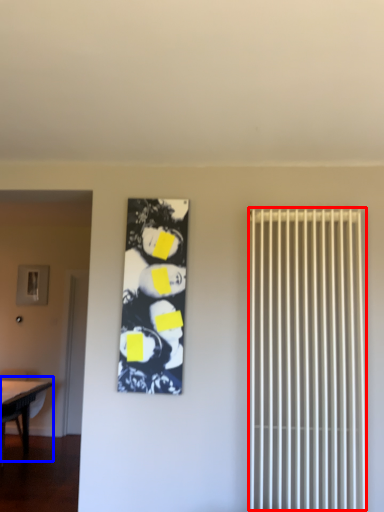
Question: Which of the following is the farthest to the observer, radiator (highlighted by a red box) or table (highlighted by a blue box)?

Choices:
 (A) radiator
 (B) table

Answer: (B)